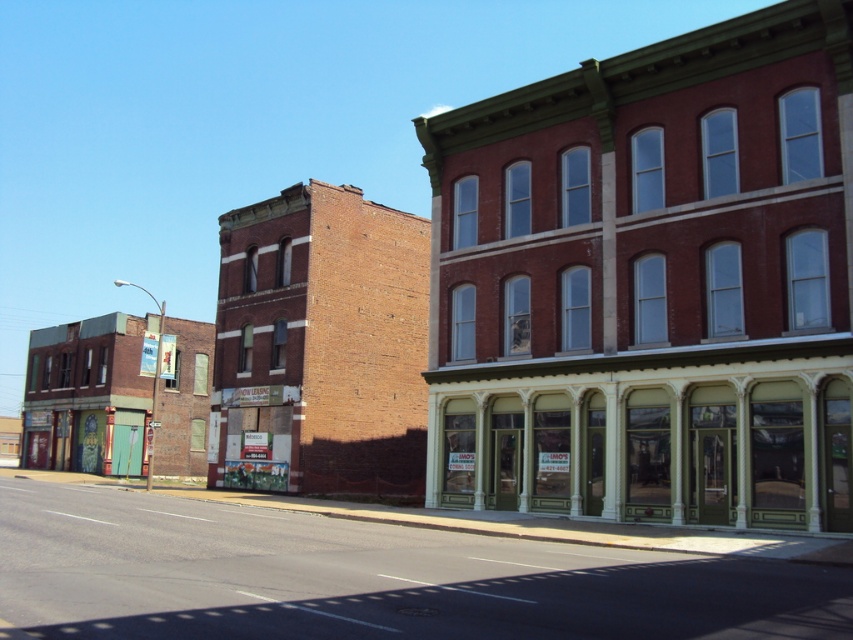
Is green painted wood storefront at center shorter than brick building at left?

Indeed, green painted wood storefront at center has a lesser height compared to brick building at left.

Between green painted wood storefront at center and brick building at left, which one is positioned higher?

Positioned higher is green painted wood storefront at center.

Between point (492, 490) and point (120, 381), which one is positioned in front?

Point (492, 490) is in front.

Image resolution: width=853 pixels, height=640 pixels. I want to click on green painted wood storefront at center, so click(x=653, y=435).

Can you confirm if brick building at left is positioned above multicolored painted doors at lower left?

Correct, brick building at left is located above multicolored painted doors at lower left.

In the scene shown: Who is lower down, brick building at left or multicolored painted doors at lower left?

multicolored painted doors at lower left is below.

Who is more distant from viewer, (86, 428) or (99, 467)?

The point (86, 428) is behind.

Locate an element on the screen. The height and width of the screenshot is (640, 853). brick building at left is located at coordinates (88, 396).

Does brick building at left have a greater height compared to green painted wood signboard at center?

Indeed, brick building at left has a greater height compared to green painted wood signboard at center.

Who is taller, brick building at left or green painted wood signboard at center?

With more height is brick building at left.

This screenshot has height=640, width=853. In order to click on brick building at left in this screenshot , I will do (88, 396).